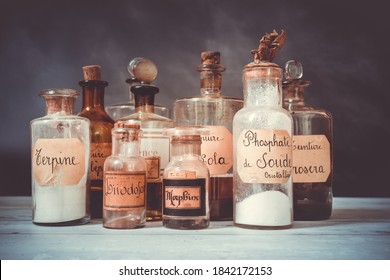
Find the location of a particular element. The image size is (390, 280). bottles is located at coordinates (303, 165), (279, 128), (210, 101), (178, 183), (159, 123), (121, 180), (61, 150), (95, 111), (122, 111).